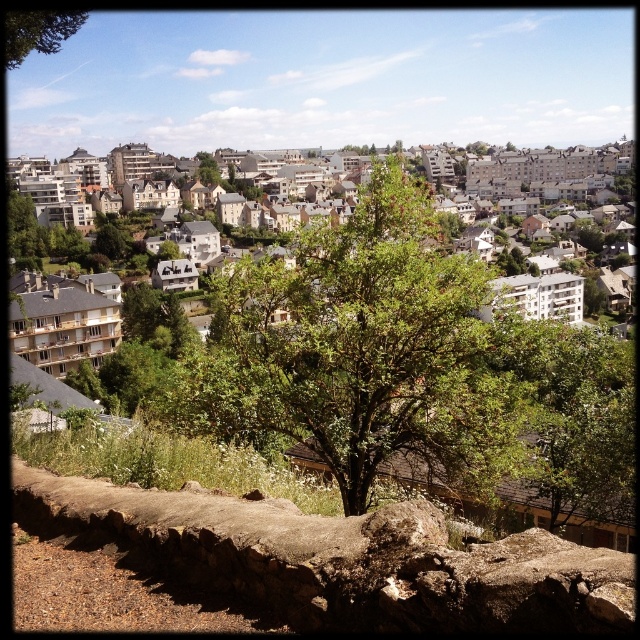
Question: In this image, where is green leafy tree at center located relative to green leafy tree at upper left?

Choices:
 (A) left
 (B) right

Answer: (B)

Question: Which object appears closest to the camera in this image?

Choices:
 (A) green leafy tree at center
 (B) green leafy tree at upper left

Answer: (A)

Question: Can you confirm if green leafy tree at center is smaller than green leafy tree at upper left?

Choices:
 (A) no
 (B) yes

Answer: (A)

Question: Which point appears farthest from the camera in this image?

Choices:
 (A) (333, 241)
 (B) (35, 42)

Answer: (B)

Question: Does green leafy tree at center appear on the right side of green leafy tree at upper left?

Choices:
 (A) no
 (B) yes

Answer: (B)

Question: Which point is closer to the camera?

Choices:
 (A) green leafy tree at upper left
 (B) green leafy tree at center

Answer: (B)